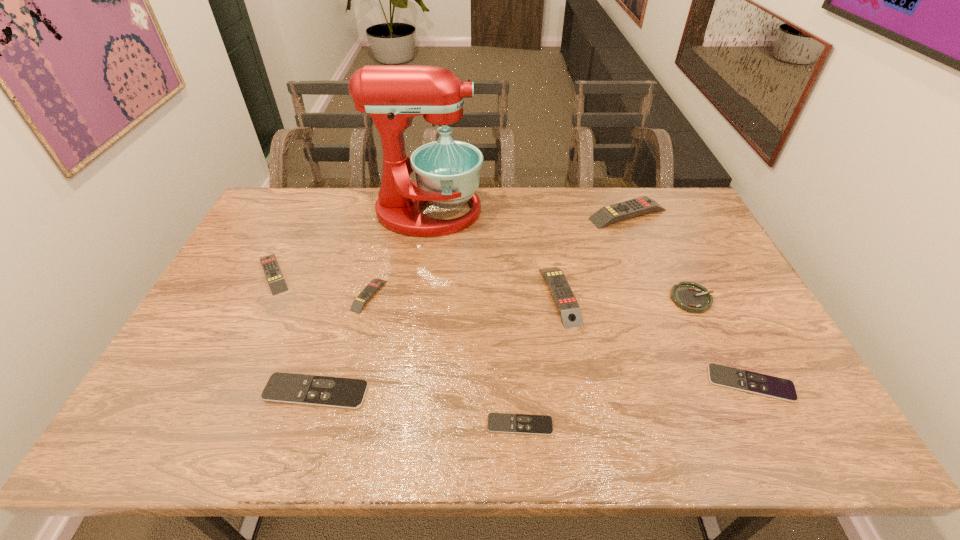
Choose which remote control is the nearest neighbor to the tallest remote control. Please provide its 2D coordinates. Your answer should be formatted as a tuple, i.e. [(x, y)], where the tuple contains the x and y coordinates of a point satisfying the conditions above.

[(565, 301)]

Select which yellow remote control appears as the closest to the smallest yellow remote control. Please provide its 2D coordinates. Your answer should be formatted as a tuple, i.e. [(x, y)], where the tuple contains the x and y coordinates of a point satisfying the conditions above.

[(277, 284)]

The image size is (960, 540). What are the coordinates of `yellow remote control that stands as the second closest to the third yellow remote control from right to left` in the screenshot? It's located at (565, 301).

Locate which black remote control is the closest to the tallest object. Please provide its 2D coordinates. Your answer should be formatted as a tuple, i.e. [(x, y)], where the tuple contains the x and y coordinates of a point satisfying the conditions above.

[(281, 387)]

Where is `black remote control identified as the closest to the nearest black remote control`? black remote control identified as the closest to the nearest black remote control is located at coordinates (281, 387).

Image resolution: width=960 pixels, height=540 pixels. Identify the location of vacant region that satisfies the following two spatial constraints: 1. on the front-facing side of the mixer; 2. on the left side of the nearest black remote control. (397, 424).

Where is `free space that satisfies the following two spatial constraints: 1. on the front-facing side of the mixer; 2. on the back side of the ashtray`? free space that satisfies the following two spatial constraints: 1. on the front-facing side of the mixer; 2. on the back side of the ashtray is located at coordinates (416, 299).

Image resolution: width=960 pixels, height=540 pixels. What are the coordinates of `free space in the image that satisfies the following two spatial constraints: 1. on the front side of the leftmost remote control; 2. on the right side of the biggest black remote control` in the screenshot? It's located at (216, 392).

The width and height of the screenshot is (960, 540). In order to click on vacant point that satisfies the following two spatial constraints: 1. on the front-facing side of the mixer; 2. on the left side of the sixth shortest remote control in this screenshot , I will do `click(417, 296)`.

Where is `free spot that satisfies the following two spatial constraints: 1. on the back side of the leftmost black remote control; 2. on the left side of the farthest remote control`? free spot that satisfies the following two spatial constraints: 1. on the back side of the leftmost black remote control; 2. on the left side of the farthest remote control is located at coordinates tap(370, 214).